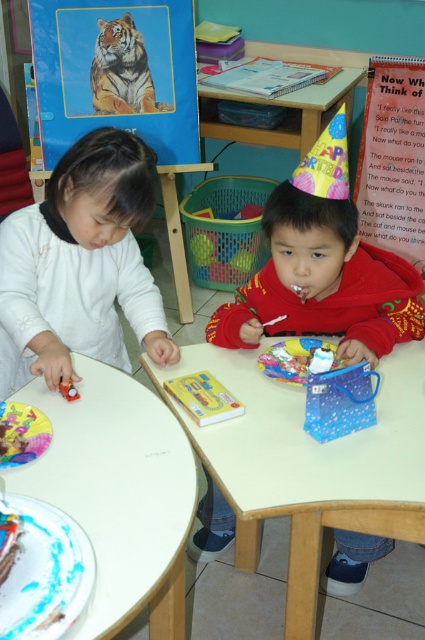
You are a teacher observing the classroom scene. You notice the white matte shirt at left and the red velvet cake at upper center. Which object is positioned higher in the image?

The white matte shirt at left is located above the red velvet cake at upper center, so it is positioned higher in the image.

You are a teacher observing the classroom scene. You need to move a book from the white glossy table at lower left to the white matte shirt at left. Which object is closer to you so you can reach it first?

The white glossy table at lower left is closer to the viewer than the white matte shirt at left, so you can reach it first.

You are a teacher in the classroom and want to hand out a small prize to the child wearing the white matte shirt at left. The prize is a sticker that needs to be placed exactly 16 inches away from the red velvet cake at upper center. Can you place the sticker on the shirt?

The white matte shirt at left and red velvet cake at upper center are 15.55 inches apart. Since the required distance is 16 inches, the sticker cannot be placed on the shirt as it is slightly closer than needed.